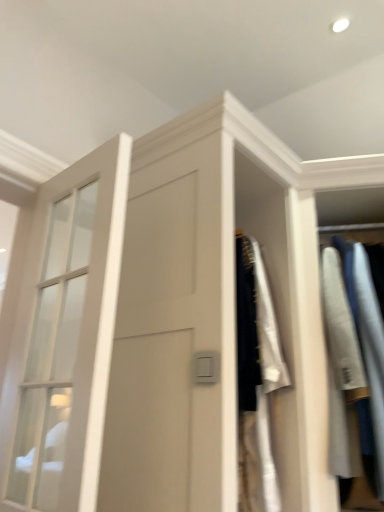
This screenshot has width=384, height=512. What do you see at coordinates (353, 362) in the screenshot?
I see `light gray cotton shirt at right` at bounding box center [353, 362].

You are a GUI agent. You are given a task and a screenshot of the screen. Output one action in this format:
    pyautogui.click(x=<x>, y=<y>)
    Task: Click on the light gray cotton shirt at right
    The width and height of the screenshot is (384, 512).
    Given the screenshot: What is the action you would take?
    pyautogui.click(x=353, y=362)

What is the approximate width of light gray cotton shirt at right?

light gray cotton shirt at right is 24.76 inches wide.

The width and height of the screenshot is (384, 512). In order to click on clear glass door at left in this screenshot , I will do `click(65, 336)`.

This screenshot has width=384, height=512. What do you see at coordinates (65, 336) in the screenshot?
I see `clear glass door at left` at bounding box center [65, 336].

The image size is (384, 512). Find the location of `light gray cotton shirt at right`. light gray cotton shirt at right is located at coordinates (353, 362).

Considering the relative positions of clear glass door at left and light gray cotton shirt at right in the image provided, is clear glass door at left to the left or to the right of light gray cotton shirt at right?

clear glass door at left is positioned on light gray cotton shirt at right's left side.

Is clear glass door at left further to the viewer compared to light gray cotton shirt at right?

No, clear glass door at left is closer to the camera.

Is point (69, 243) closer to viewer compared to point (333, 375)?

Yes, point (69, 243) is closer to viewer.

From the image's perspective, between clear glass door at left and light gray cotton shirt at right, which one is located above?

clear glass door at left is shown above in the image.

Consider the image. From a real-world perspective, who is located lower, clear glass door at left or light gray cotton shirt at right?

From a 3D spatial view, clear glass door at left is below.

Considering the sizes of objects clear glass door at left and light gray cotton shirt at right in the image provided, who is wider, clear glass door at left or light gray cotton shirt at right?

light gray cotton shirt at right is wider.

Considering the sizes of objects clear glass door at left and light gray cotton shirt at right in the image provided, who is taller, clear glass door at left or light gray cotton shirt at right?

With more height is light gray cotton shirt at right.

Is clear glass door at left bigger than light gray cotton shirt at right?

No.

Do you think clear glass door at left is within light gray cotton shirt at right, or outside of it?

clear glass door at left is not enclosed by light gray cotton shirt at right.

Are clear glass door at left and light gray cotton shirt at right making contact?

No, clear glass door at left is not making contact with light gray cotton shirt at right.

Is clear glass door at left oriented away from light gray cotton shirt at right?

Absolutely, clear glass door at left is directed away from light gray cotton shirt at right.

How different are the orientations of clear glass door at left and light gray cotton shirt at right in degrees?

The angular difference between clear glass door at left and light gray cotton shirt at right is 30.8 degrees.

Measure the distance between clear glass door at left and light gray cotton shirt at right.

A distance of 1.09 meters exists between clear glass door at left and light gray cotton shirt at right.

This screenshot has height=512, width=384. In order to click on window on the left of light gray cotton shirt at right in this screenshot , I will do `click(65, 336)`.

Is light gray cotton shirt at right at the left side of clear glass door at left?

Incorrect, light gray cotton shirt at right is not on the left side of clear glass door at left.

Considering the positions of objects light gray cotton shirt at right and clear glass door at left in the image provided, who is behind, light gray cotton shirt at right or clear glass door at left?

Positioned behind is light gray cotton shirt at right.

Considering the positions of points (357, 458) and (95, 213), is point (357, 458) closer to camera compared to point (95, 213)?

No, (357, 458) is behind (95, 213).

From the image's perspective, which is above, light gray cotton shirt at right or clear glass door at left?

clear glass door at left.

From a real-world perspective, is light gray cotton shirt at right on clear glass door at left?

Yes, from a real-world perspective, light gray cotton shirt at right is above clear glass door at left.

In the scene shown: Can you confirm if light gray cotton shirt at right is wider than clear glass door at left?

Yes, light gray cotton shirt at right is wider than clear glass door at left.

Which of these two, light gray cotton shirt at right or clear glass door at left, stands shorter?

clear glass door at left.

In the scene shown: Between light gray cotton shirt at right and clear glass door at left, which one has smaller size?

With smaller size is clear glass door at left.

Is light gray cotton shirt at right spatially inside clear glass door at left, or outside of it?

light gray cotton shirt at right is spatially situated outside clear glass door at left.

Is light gray cotton shirt at right far away from clear glass door at left?

That's right, there is a large distance between light gray cotton shirt at right and clear glass door at left.

Is light gray cotton shirt at right oriented away from clear glass door at left?

No, light gray cotton shirt at right is not facing the opposite direction of clear glass door at left.

You are a GUI agent. You are given a task and a screenshot of the screen. Output one action in this format:
    pyautogui.click(x=<x>, y=<y>)
    Task: Click on the window beneath the light gray cotton shirt at right (from a real-world perspective)
    
    Given the screenshot: What is the action you would take?
    pyautogui.click(x=65, y=336)

You are a GUI agent. You are given a task and a screenshot of the screen. Output one action in this format:
    pyautogui.click(x=<x>, y=<y>)
    Task: Click on the clothing on the right of clear glass door at left
    The width and height of the screenshot is (384, 512).
    Given the screenshot: What is the action you would take?
    [x=353, y=362]

In order to click on clothing located above the clear glass door at left (from a real-world perspective) in this screenshot , I will do `click(353, 362)`.